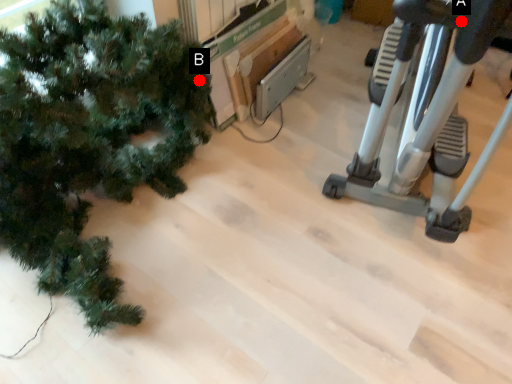
Question: Two points are circled on the image, labeled by A and B beside each circle. Among these points, which one is nearest to the camera?

Choices:
 (A) A is closer
 (B) B is closer

Answer: (A)